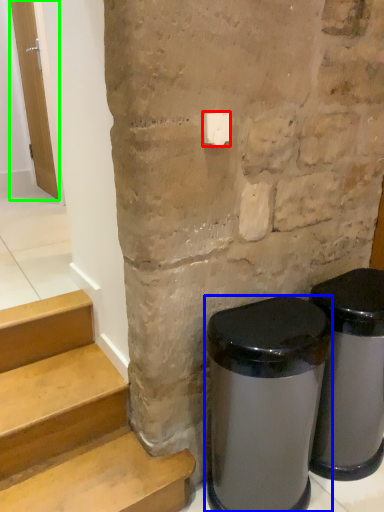
Question: Which object is the farthest from light switch (highlighted by a red box)? Choose among these: waste container (highlighted by a blue box) or door (highlighted by a green box).

Choices:
 (A) waste container
 (B) door

Answer: (B)